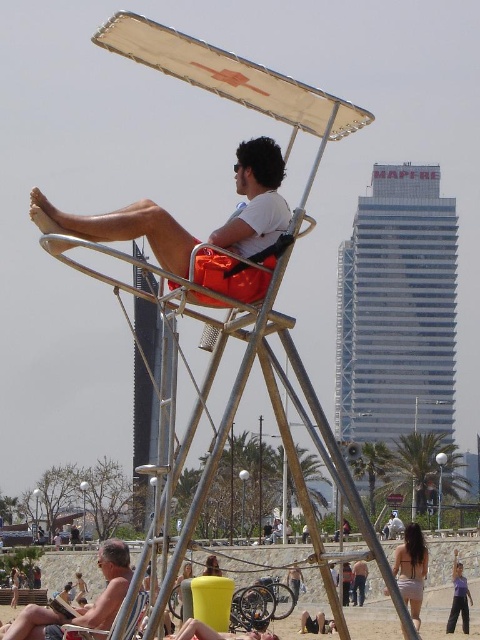
You are standing on the beach and want to take a photo of the point at coordinates (134,618). The camera you have can focus on objects up to 70 meters away. Will the point be in focus?

The point at coordinates (134,618) is 66.13 meters away from the camera, which is within the camera focus range of 70 meters. Therefore, the point will be in focus.

Consider the image. You are standing at the beach and want to take a photo of the matte orange shorts at center and the purple fabric pants at lower right in the same frame. The camera you have can capture objects within a 150 feet range. Can both objects be in the same photo?

The matte orange shorts at center is 128.25 feet away from the purple fabric pants at lower right. Since the distance between them is within the camera range of 150 feet, both objects can be captured in the same photo.

You are a surfer who wants to retrieve your smooth black surfboard at center from the beach scene. Given that the lifeguard chair is at coordinates point A and the palm trees are at point B, can you estimate the direction you need to walk from the lifeguard chair to reach your surfboard?

The smooth black surfboard at center is located at point (315, 624), which is to the south of the lifeguard chair at point A. Therefore, you should walk south from the lifeguard chair to reach your surfboard.